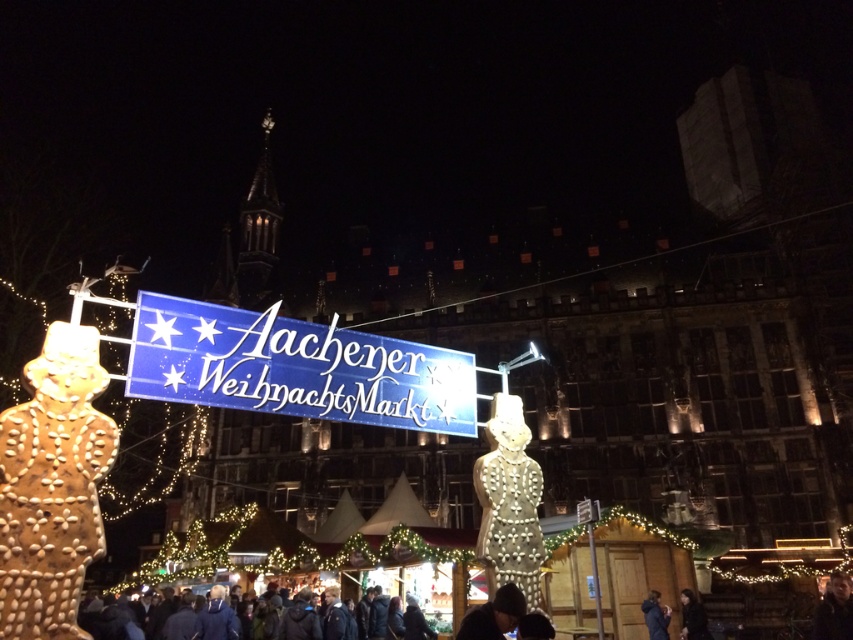
Question: Which of the following is the farthest from the observer?

Choices:
 (A) dark blue jacket at lower right
 (B) dark blue knit hat at lower center

Answer: (A)

Question: Which point is farther from the camera taking this photo?

Choices:
 (A) (682, 630)
 (B) (653, 609)

Answer: (A)

Question: Is illuminated gingerbread man at center to the left of smooth skin face at lower right from the viewer's perspective?

Choices:
 (A) no
 (B) yes

Answer: (B)

Question: Estimate the real-world distances between objects in this image. Which object is farther from the smooth skin face at lower right?

Choices:
 (A) dark blue knit hat at lower center
 (B) dark blue jacket at lower center

Answer: (A)

Question: Observing the image, what is the correct spatial positioning of blue glossy sign at center in reference to illuminated gingerbread man at left?

Choices:
 (A) right
 (B) left

Answer: (A)

Question: Is illuminated gingerbread man at center smaller than dark blue knit hat at lower center?

Choices:
 (A) yes
 (B) no

Answer: (B)